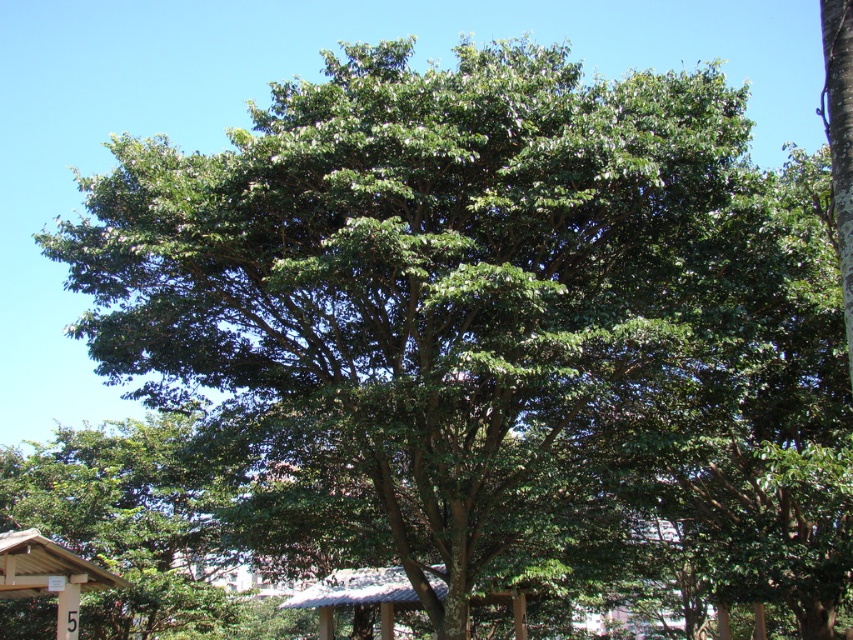
Question: Is thatched roof gazebo at center to the left of wooden sign at lower left from the viewer's perspective?

Choices:
 (A) yes
 (B) no

Answer: (B)

Question: Is thatched roof gazebo at center above wooden sign at lower left?

Choices:
 (A) yes
 (B) no

Answer: (B)

Question: Is thatched roof gazebo at center above wooden sign at lower left?

Choices:
 (A) no
 (B) yes

Answer: (A)